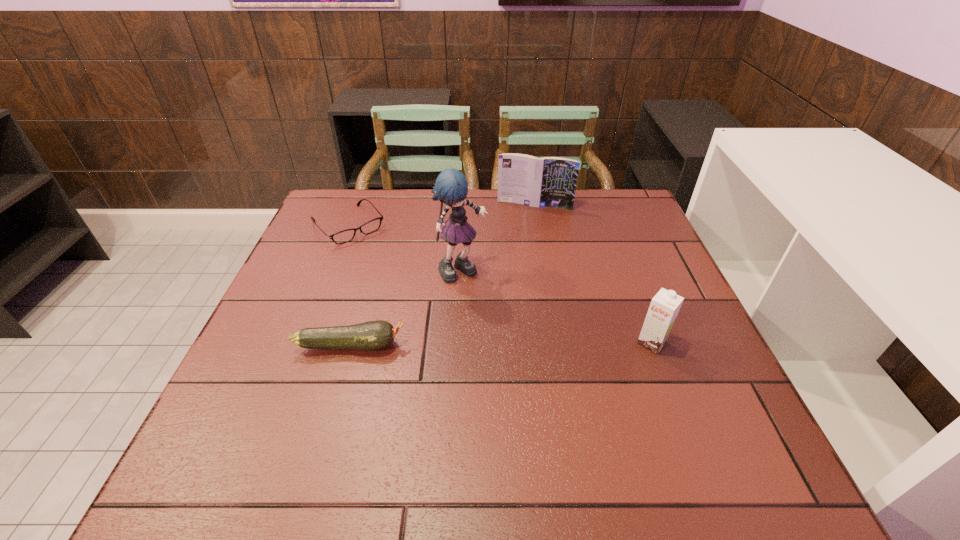
The height and width of the screenshot is (540, 960). What are the coordinates of `vacant region that satisfies the following two spatial constraints: 1. on the back side of the book; 2. on the left side of the shortest object` in the screenshot? It's located at (357, 205).